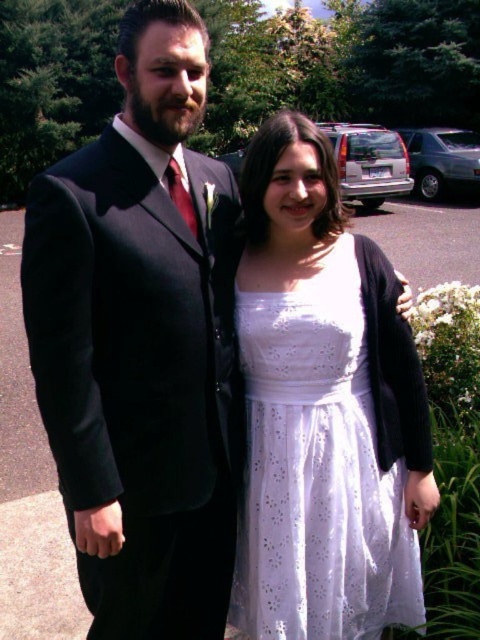
Question: Which point is closer to the camera?

Choices:
 (A) dark gray wool suit at left
 (B) white lace dress at center

Answer: (A)

Question: Which of the following is the farthest from the observer?

Choices:
 (A) (253, 444)
 (B) (170, 422)

Answer: (A)

Question: From the image, what is the correct spatial relationship of dark gray wool suit at left in relation to white lace dress at center?

Choices:
 (A) below
 (B) above

Answer: (B)

Question: Does dark gray wool suit at left come behind white lace dress at center?

Choices:
 (A) no
 (B) yes

Answer: (A)

Question: Is dark gray wool suit at left positioned before white lace dress at center?

Choices:
 (A) yes
 (B) no

Answer: (A)